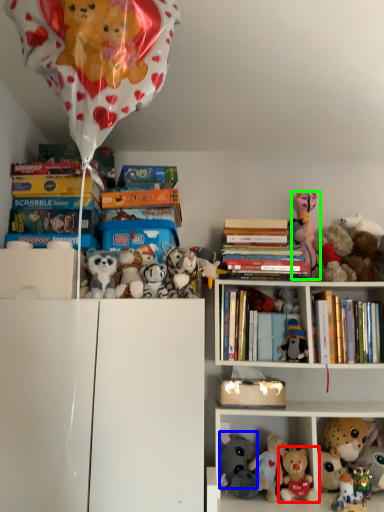
Question: Which object is the closest to the toy (highlighted by a red box)? Choose among these: toy (highlighted by a blue box) or toy (highlighted by a green box).

Choices:
 (A) toy
 (B) toy

Answer: (A)